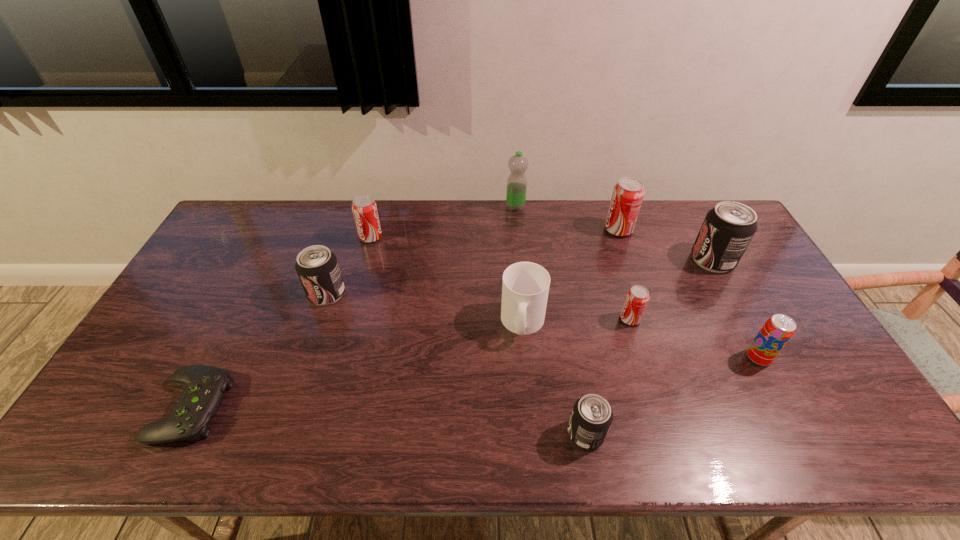
Where is `water bottle`? The height and width of the screenshot is (540, 960). water bottle is located at coordinates (517, 182).

The height and width of the screenshot is (540, 960). Identify the location of the farthest object. 517,182.

At what (x,y) coordinates should I click in order to perform the action: click on the biggest red soda can. Please return your answer as a coordinate pair (x, y). This screenshot has height=540, width=960. Looking at the image, I should click on (628, 193).

Identify the location of the rightmost black soda can. (728, 228).

Find the location of `the third farthest soda can`. the third farthest soda can is located at coordinates (728, 228).

You are a GUI agent. You are given a task and a screenshot of the screen. Output one action in this format:
    pyautogui.click(x=<x>, y=<y>)
    Task: Click on the mug
    The height and width of the screenshot is (540, 960).
    Given the screenshot: What is the action you would take?
    pyautogui.click(x=525, y=287)

Find the location of a particular element. Image resolution: width=960 pixels, height=540 pixels. the leftmost black soda can is located at coordinates (x=317, y=267).

This screenshot has height=540, width=960. I want to click on the fourth nearest soda can, so click(317, 267).

Find the location of a particular element. The height and width of the screenshot is (540, 960). the leftmost red soda can is located at coordinates (364, 208).

Where is `the third nearest object`? the third nearest object is located at coordinates (777, 331).